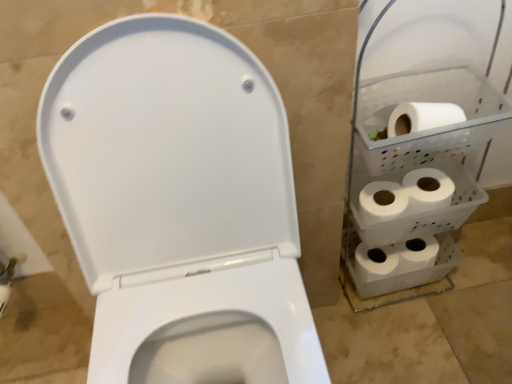
Identify the location of vacant space situated on the left part of white matte toilet paper at lower right, positioned as the 2th toilet paper in left-to-right order. (337, 312).